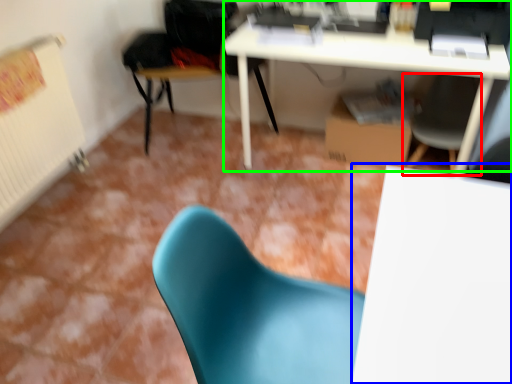
Question: Based on their relative distances, which object is nearer to chair (highlighted by a red box)? Choose from table (highlighted by a blue box) and desk (highlighted by a green box).

Choices:
 (A) table
 (B) desk

Answer: (B)